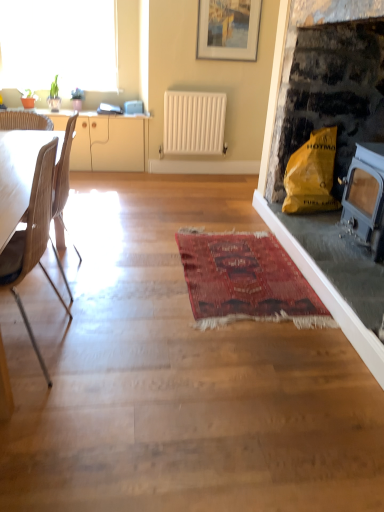
Where is `white matte radiator at center`? This screenshot has height=512, width=384. white matte radiator at center is located at coordinates (194, 123).

The width and height of the screenshot is (384, 512). What do you see at coordinates (298, 242) in the screenshot? I see `yellow paper bag at right` at bounding box center [298, 242].

Measure the distance between yellow paper bag at right and camera.

They are 1.75 meters apart.

What is the approximate width of wooden chair at left, which ranks as the first chair in front-to-back order?

The width of wooden chair at left, which ranks as the first chair in front-to-back order, is 15.34 inches.

What do you see at coordinates (228, 29) in the screenshot? This screenshot has height=512, width=384. I see `matte white picture frame at upper center` at bounding box center [228, 29].

The image size is (384, 512). Identify the location of light brown wood chair at left, which appears as the second chair when viewed from the front. (63, 173).

From a real-world perspective, between yellow paper bag at right and wooden chair at left, which ranks as the first chair in front-to-back order, who is vertically higher?

yellow paper bag at right is physically above.

Considering the sizes of yellow paper bag at right and wooden chair at left, which is the 2th chair from back to front, in the image, is yellow paper bag at right bigger or smaller than wooden chair at left, which is the 2th chair from back to front,?

Considering their sizes, yellow paper bag at right takes up more space than wooden chair at left, which is the 2th chair from back to front.

In the scene shown: Is yellow paper bag at right not near wooden chair at left, which is the 2th chair from back to front?

Yes.

Does yellow paper bag at right appear on the right side of wooden chair at left, which ranks as the first chair in front-to-back order?

Yes, yellow paper bag at right is to the right of wooden chair at left, which ranks as the first chair in front-to-back order.

Considering the relative sizes of white matte radiator at center and transparent glass window at upper left in the image provided, is white matte radiator at center shorter than transparent glass window at upper left?

Correct, white matte radiator at center is not as tall as transparent glass window at upper left.

Is the position of white matte radiator at center less distant than that of transparent glass window at upper left?

No, white matte radiator at center is further to the viewer.

From a real-world perspective, which object rests below the other?

white matte radiator at center.

Is white matte radiator at center positioned far away from transparent glass window at upper left?

Yes.

Considering the points (108, 151) and (371, 369), which point is in front, point (108, 151) or point (371, 369)?

Point (371, 369)

Is beige wood cabinet at left spatially inside yellow paper bag at right, or outside of it?

beige wood cabinet at left is not enclosed by yellow paper bag at right.

Does beige wood cabinet at left appear on the left side of yellow paper bag at right?

Indeed, beige wood cabinet at left is positioned on the left side of yellow paper bag at right.

Consider the image. Can you confirm if beige wood cabinet at left is shorter than yellow paper bag at right?

Indeed, beige wood cabinet at left has a lesser height compared to yellow paper bag at right.

Is matte white picture frame at upper center in front of or behind beige wood cabinet at left in the image?

In the image, matte white picture frame at upper center appears in front of beige wood cabinet at left.

Where is `picture frame located above the beige wood cabinet at left (from the image's perspective)`? This screenshot has width=384, height=512. picture frame located above the beige wood cabinet at left (from the image's perspective) is located at coordinates (228, 29).

Can you tell me how much matte white picture frame at upper center and beige wood cabinet at left differ in facing direction?

0.623 degrees separate the facing orientations of matte white picture frame at upper center and beige wood cabinet at left.

From the image's perspective, is matte white picture frame at upper center on beige wood cabinet at left?

Yes, from the image's perspective, matte white picture frame at upper center is over beige wood cabinet at left.

How distant is matte white picture frame at upper center from yellow paper bag at right?

matte white picture frame at upper center is 5.11 feet from yellow paper bag at right.

From a real-world perspective, is matte white picture frame at upper center physically below yellow paper bag at right?

No, from a real-world perspective, matte white picture frame at upper center is not under yellow paper bag at right.

Considering the points (221, 46) and (263, 187), which point is behind, point (221, 46) or point (263, 187)?

The point (221, 46) is more distant.

Is matte white picture frame at upper center spatially inside yellow paper bag at right, or outside of it?

matte white picture frame at upper center cannot be found inside yellow paper bag at right.

Which is more distant, (252, 1) or (101, 84)?

Positioned behind is point (101, 84).

From the picture: Which object is positioned more to the left, matte white picture frame at upper center or transparent glass window at upper left?

transparent glass window at upper left is more to the left.

Does matte white picture frame at upper center have a lesser height compared to transparent glass window at upper left?

Yes.

From the image's perspective, is wooden chair at left, which is the 2th chair from back to front, above light brown wood chair at left, placed as the first chair when sorted from back to front?

No, from the image's perspective, wooden chair at left, which is the 2th chair from back to front, is not above light brown wood chair at left, placed as the first chair when sorted from back to front.

Consider the image. Is wooden chair at left, which ranks as the first chair in front-to-back order, aimed at light brown wood chair at left, which appears as the second chair when viewed from the front?

No, wooden chair at left, which ranks as the first chair in front-to-back order, is not aimed at light brown wood chair at left, which appears as the second chair when viewed from the front.

Is wooden chair at left, which is the 2th chair from back to front, next to light brown wood chair at left, placed as the first chair when sorted from back to front?

wooden chair at left, which is the 2th chair from back to front, and light brown wood chair at left, placed as the first chair when sorted from back to front, are not in contact.

The width and height of the screenshot is (384, 512). I want to click on the 2nd chair below the yellow paper bag at right (from a real-world perspective), so click(32, 239).

In order to click on window above the white matte radiator at center (from the image's perspective) in this screenshot , I will do `click(58, 44)`.

Considering their positions, is transparent glass window at upper left positioned further to matte white picture frame at upper center than beige wood cabinet at left?

transparent glass window at upper left.

Which object lies nearer to the anchor point beige wood cabinet at left, yellow paper bag at right or white matte radiator at center?

Among the two, white matte radiator at center is located nearer to beige wood cabinet at left.

Looking at the image, which one is located further to transparent glass window at upper left, white matte radiator at center or red woven rug at center?

red woven rug at center.

Based on their spatial positions, is light brown wood chair at left, which appears as the second chair when viewed from the front, or red woven rug at center further from white matte radiator at center?

red woven rug at center is further to white matte radiator at center.

Which object lies further to the anchor point yellow paper bag at right, wooden chair at left, which is the 2th chair from back to front, or light brown wood chair at left, placed as the first chair when sorted from back to front?

wooden chair at left, which is the 2th chair from back to front, lies further to yellow paper bag at right than the other object.

Based on the photo, estimate the real-world distances between objects in this image. Which object is further from wooden chair at left, which ranks as the first chair in front-to-back order, beige wood cabinet at left or transparent glass window at upper left?

transparent glass window at upper left lies further to wooden chair at left, which ranks as the first chair in front-to-back order, than the other object.

Consider the image. Which object lies further to the anchor point wooden chair at left, which is the 2th chair from back to front, yellow paper bag at right or transparent glass window at upper left?

transparent glass window at upper left lies further to wooden chair at left, which is the 2th chair from back to front, than the other object.

Based on their spatial positions, is beige wood cabinet at left or wooden chair at left, which ranks as the first chair in front-to-back order, closer to light brown wood chair at left, placed as the first chair when sorted from back to front?

wooden chair at left, which ranks as the first chair in front-to-back order, is closer to light brown wood chair at left, placed as the first chair when sorted from back to front.

This screenshot has width=384, height=512. What are the coordinates of `radiator between light brown wood chair at left, which appears as the second chair when viewed from the front, and beige wood cabinet at left in the front-back direction` in the screenshot? It's located at (194, 123).

This screenshot has height=512, width=384. In order to click on mat between yellow paper bag at right and beige wood cabinet at left from front to back in this screenshot , I will do `click(246, 280)`.

Locate an element on the screen. Image resolution: width=384 pixels, height=512 pixels. picture frame located between light brown wood chair at left, which appears as the second chair when viewed from the front, and beige wood cabinet at left in the depth direction is located at coordinates (228, 29).

At what (x,y) coordinates should I click in order to perform the action: click on chair positioned between wooden chair at left, which ranks as the first chair in front-to-back order, and transparent glass window at upper left from near to far. Please return your answer as a coordinate pair (x, y). This screenshot has width=384, height=512. Looking at the image, I should click on (63, 173).